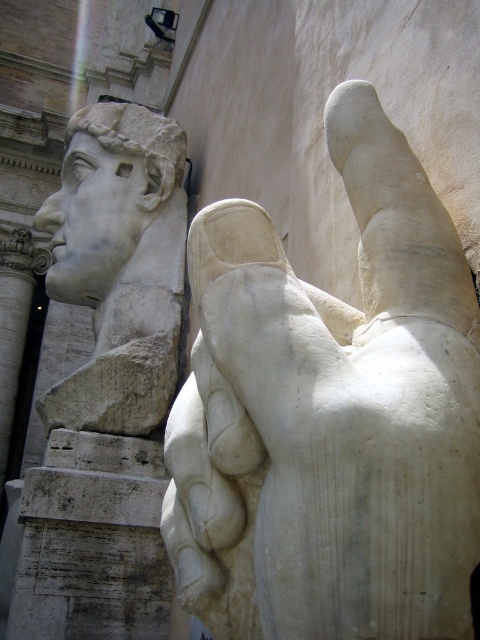
You are an art conservator examining the marble statue. You notice two specific points on the statue, labeled as point 1 at coordinates point (333, 506) and point 2 at coordinates point (75, 122). Which of these points is positioned closer to your viewpoint as you observe the statue?

Point (333, 506) is closer to the camera than point (75, 122), so point 1 at coordinates point (333, 506) is positioned closer to your viewpoint.

You are an art conservator examining the statue. You notice a point at coordinates [331,413]. What object is located at this point?

The white marble hand at center is located at point [331,413].

Looking at this image, you are an art conservator examining the statue. You need to determine which object is taller between the white marble hand at center and the white marble head at upper left. Which one is taller?

The white marble hand at center is taller than the white marble head at upper left according to the description.